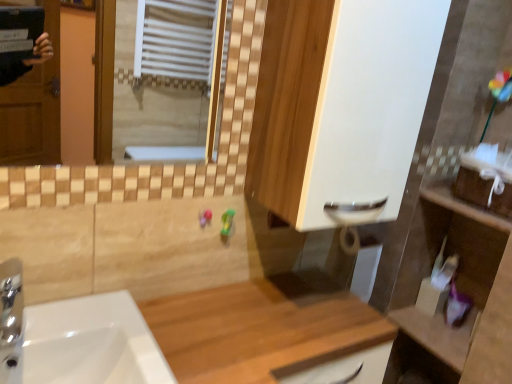
You are a GUI agent. You are given a task and a screenshot of the screen. Output one action in this format:
    pyautogui.click(x=<x>, y=<y>)
    Task: Click on the vacant area on top of white glossy sink at lower left (from a real-world perspective)
    The image size is (512, 384).
    Given the screenshot: What is the action you would take?
    pyautogui.click(x=87, y=327)